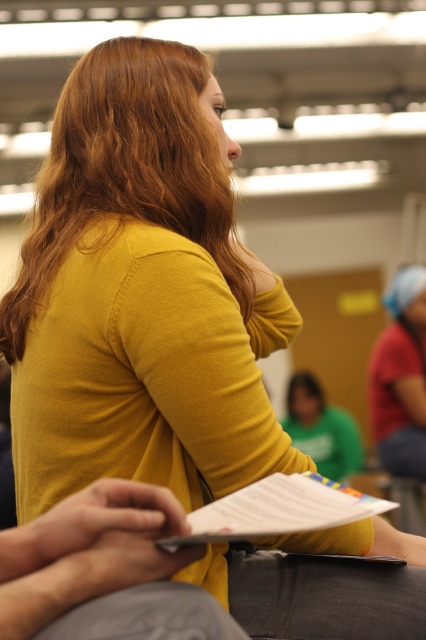
Looking at this image, is golden smooth hair at upper center closer to camera compared to white paper at center?

No, golden smooth hair at upper center is further to the viewer.

Is point (81, 93) positioned before point (255, 499)?

No, (81, 93) is further to viewer.

Locate an element on the screen. golden smooth hair at upper center is located at coordinates (126, 168).

Identify the location of golden smooth hair at upper center. (126, 168).